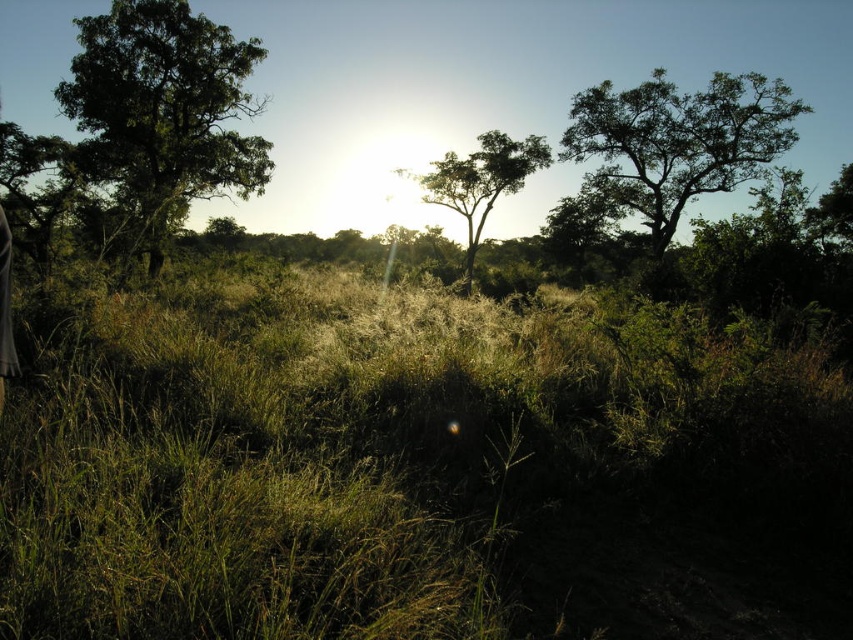
Question: Does green grass at center appear on the right side of green leafy tree at center?

Choices:
 (A) yes
 (B) no

Answer: (B)

Question: Is green grass at center smaller than green leafy tree at upper left?

Choices:
 (A) no
 (B) yes

Answer: (B)

Question: Which object is the closest to the green leafy tree at center?

Choices:
 (A) green leafy tree at upper left
 (B) green grass at center
 (C) green leafy tree at upper right

Answer: (C)

Question: Is green grass at center thinner than green leafy tree at upper left?

Choices:
 (A) yes
 (B) no

Answer: (B)

Question: Which object is the farthest from the green leafy tree at center?

Choices:
 (A) green leafy tree at upper left
 (B) green leafy tree at upper right
 (C) green grass at center

Answer: (C)

Question: Which object is positioned farthest from the green leafy tree at upper right?

Choices:
 (A) green leafy tree at upper left
 (B) green leafy tree at center
 (C) green grass at center

Answer: (C)